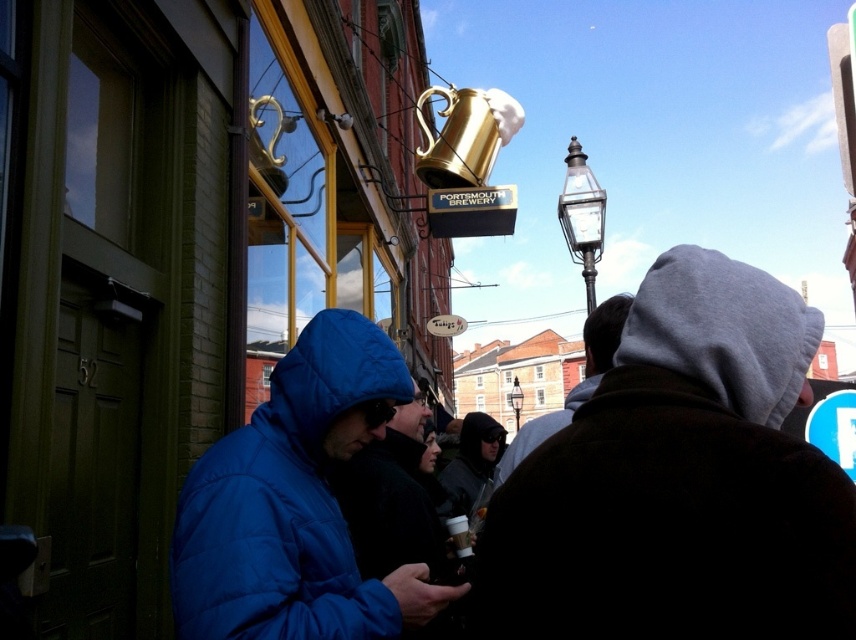
You are standing at the entrance of Portsmouth Brewery and want to find the person wearing the puffy blue jacket at center. What are the coordinates to locate them?

The puffy blue jacket at center is located at coordinates point (296, 504).

You are a photographer standing in front of the Portsmouth Brewery. You notice two jackets in the scene. Which jacket is positioned lower in the image, the puffy blue jacket at center or the gray fleece jacket at upper right?

The puffy blue jacket at center is positioned lower in the image than the gray fleece jacket at upper right.